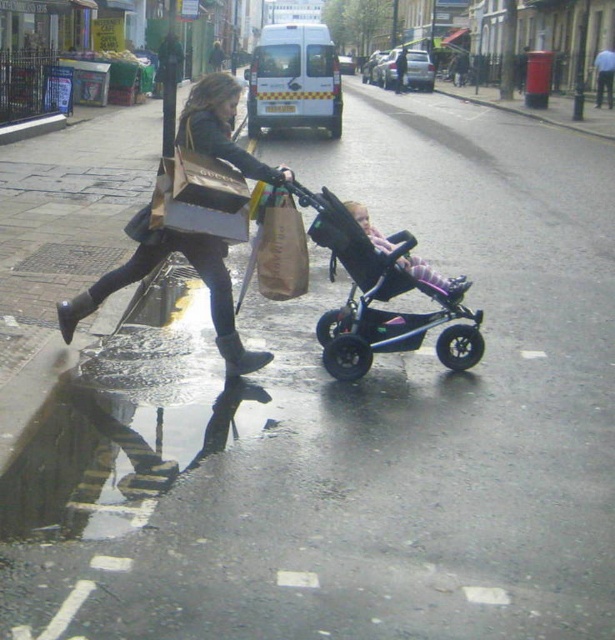
Question: Which is farther from the brown paper bag at center?

Choices:
 (A) soft pink fabric stroller at center
 (B) black plastic stroller at center

Answer: (A)

Question: In this image, where is black plastic stroller at center located relative to black rubber rain boot at lower left?

Choices:
 (A) right
 (B) left

Answer: (A)

Question: Estimate the real-world distances between objects in this image. Which object is farther from the soft pink fabric stroller at center?

Choices:
 (A) matte black jacket at center
 (B) black rubber rain boot at lower left

Answer: (B)

Question: Is brown paper bag at center bigger than brown suede rain boot at lower center?

Choices:
 (A) yes
 (B) no

Answer: (A)

Question: Does black plastic stroller at center have a lesser width compared to brown paper bag at center?

Choices:
 (A) yes
 (B) no

Answer: (B)

Question: Which object is the farthest from the black plastic stroller at center?

Choices:
 (A) soft pink fabric stroller at center
 (B) brown suede rain boot at lower center

Answer: (B)